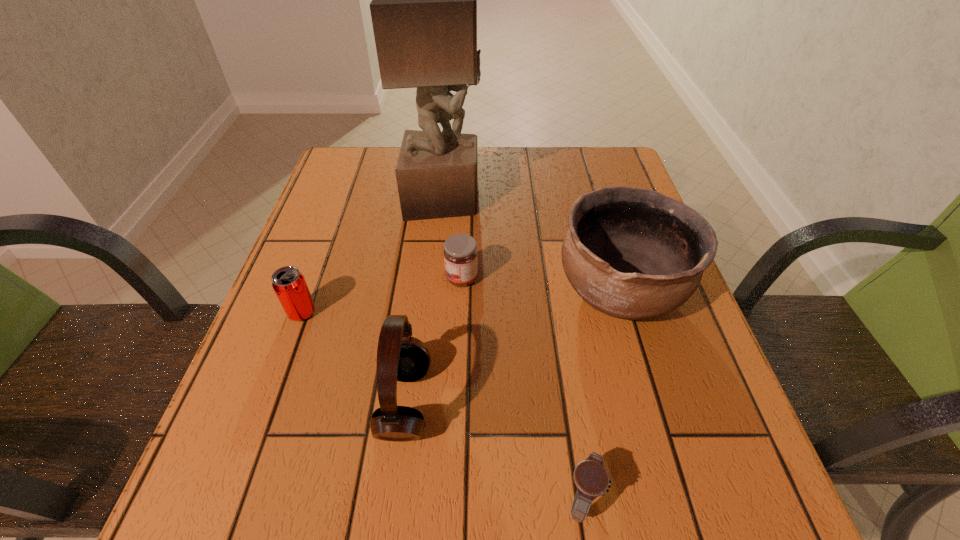
In the image, there is a desktop. Identify the location of free region at the left edge. (330, 339).

You are a GUI agent. You are given a task and a screenshot of the screen. Output one action in this format:
    pyautogui.click(x=<x>, y=<y>)
    Task: Click on the free spot at the right edge of the desktop
    The height and width of the screenshot is (540, 960).
    Given the screenshot: What is the action you would take?
    pyautogui.click(x=732, y=421)

The width and height of the screenshot is (960, 540). Find the location of `free spot at the far left corner of the desktop`. free spot at the far left corner of the desktop is located at coordinates (384, 154).

Where is `vacant space at the near left corner of the desktop`? The width and height of the screenshot is (960, 540). vacant space at the near left corner of the desktop is located at coordinates (207, 532).

The image size is (960, 540). In the image, there is a desktop. Identify the location of free region at the far right corner. (568, 165).

Locate an element on the screen. vacant space at the near right corner of the desktop is located at coordinates (657, 497).

Where is `vacant area between the leftmost object and the shortest object`? The height and width of the screenshot is (540, 960). vacant area between the leftmost object and the shortest object is located at coordinates point(442,405).

This screenshot has width=960, height=540. I want to click on free spot between the jam and the leftmost object, so click(x=382, y=295).

The image size is (960, 540). What are the coordinates of `vacant space that is in between the second nearest object and the shortest object` in the screenshot? It's located at (493, 450).

Where is `free space that is in between the pottery and the jam`? free space that is in between the pottery and the jam is located at coordinates (540, 285).